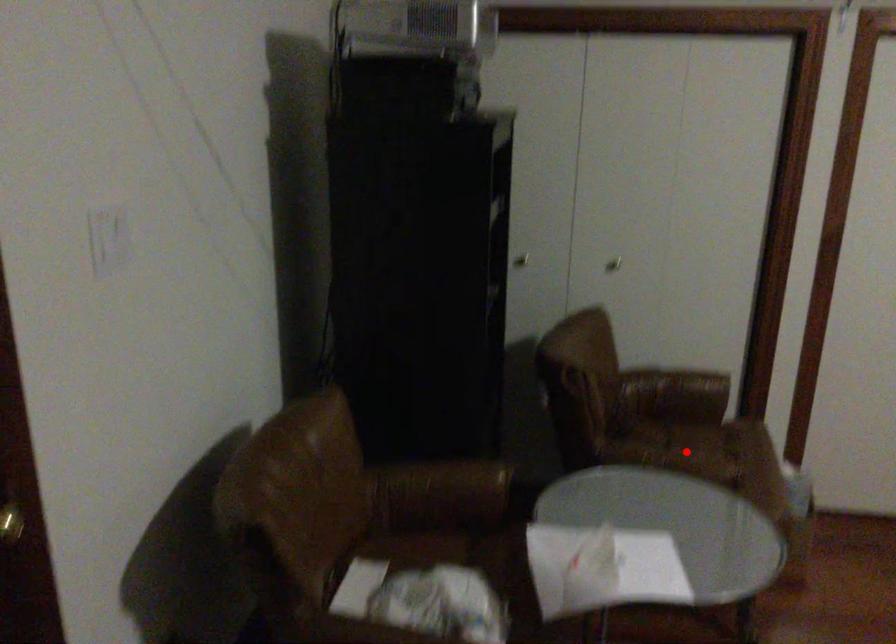
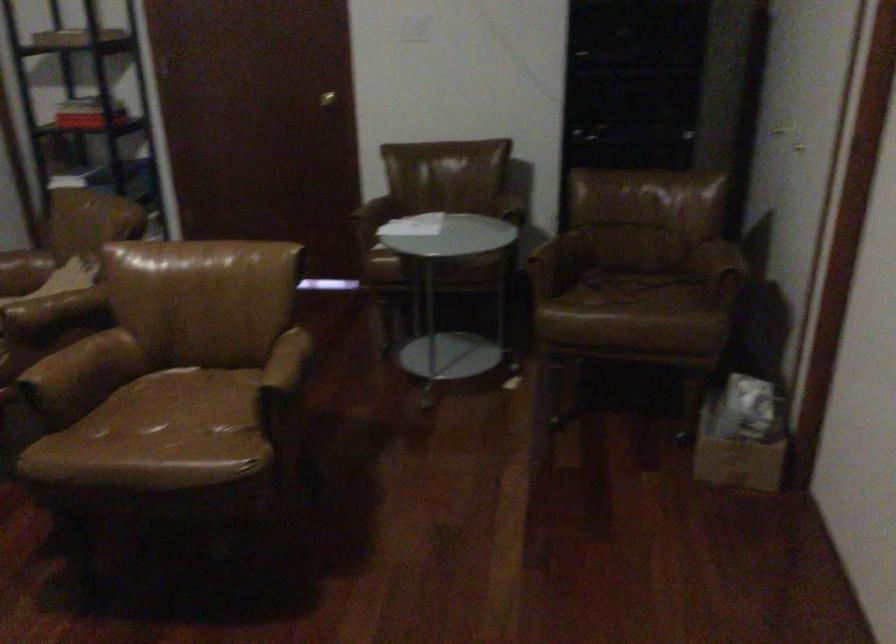
Question: I am providing you with two images of the same scene from different viewpoints. In image1, a red point is highlighted. Considering the same 3D point in image2, which of the following is correct?

Choices:
 (A) It is closer
 (B) It is farther

Answer: (B)